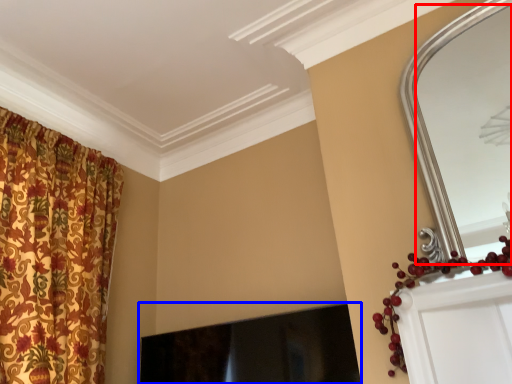
Question: Which of the following is the farthest to the observer, mirror (highlighted by a red box) or fireplace (highlighted by a blue box)?

Choices:
 (A) mirror
 (B) fireplace

Answer: (B)